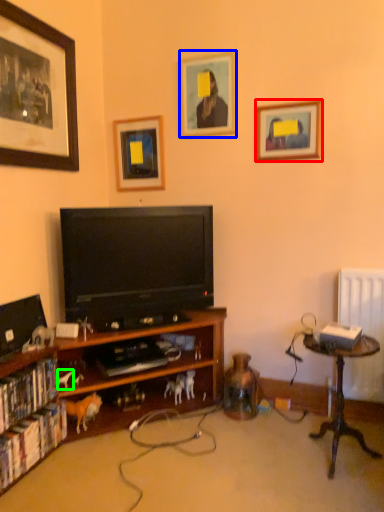
Question: Estimate the real-world distances between objects in this image. Which object is closer to picture frame (highlighted by a red box), picture frame (highlighted by a blue box) or animal (highlighted by a green box)?

Choices:
 (A) picture frame
 (B) animal

Answer: (A)